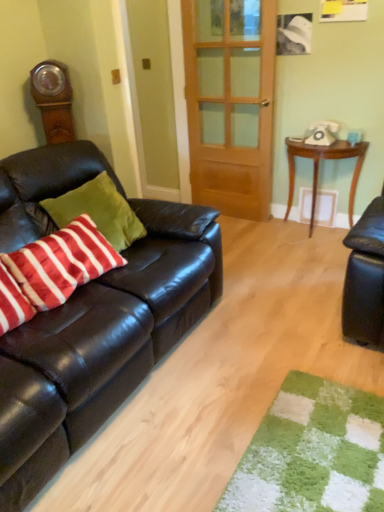
Question: Considering the relative sizes of white plastic phone at upper right and matte black couch at left in the image provided, is white plastic phone at upper right smaller than matte black couch at left?

Choices:
 (A) yes
 (B) no

Answer: (A)

Question: Does white plastic phone at upper right have a greater width compared to matte black couch at left?

Choices:
 (A) yes
 (B) no

Answer: (B)

Question: Is white plastic phone at upper right thinner than matte black couch at left?

Choices:
 (A) yes
 (B) no

Answer: (A)

Question: Is white plastic phone at upper right not within matte black couch at left?

Choices:
 (A) no
 (B) yes

Answer: (B)

Question: Can you confirm if white plastic phone at upper right is shorter than matte black couch at left?

Choices:
 (A) yes
 (B) no

Answer: (A)

Question: Is matte black couch at left a part of white plastic phone at upper right?

Choices:
 (A) yes
 (B) no

Answer: (B)

Question: From a real-world perspective, is velvety red and white striped pillow at left, the first pillow viewed from the right, positioned under striped cotton pillow at left, positioned as the second pillow in right-to-left order, based on gravity?

Choices:
 (A) yes
 (B) no

Answer: (A)

Question: Is velvety red and white striped pillow at left, which ranks as the 2th pillow in left-to-right order, at the left side of striped cotton pillow at left, arranged as the first pillow when viewed from the left?

Choices:
 (A) no
 (B) yes

Answer: (A)

Question: Is velvety red and white striped pillow at left, which ranks as the 2th pillow in left-to-right order, further to the viewer compared to striped cotton pillow at left, arranged as the first pillow when viewed from the left?

Choices:
 (A) yes
 (B) no

Answer: (A)

Question: Does velvety red and white striped pillow at left, which ranks as the 2th pillow in left-to-right order, have a lesser width compared to striped cotton pillow at left, positioned as the second pillow in right-to-left order?

Choices:
 (A) yes
 (B) no

Answer: (A)

Question: Is velvety red and white striped pillow at left, which ranks as the 2th pillow in left-to-right order, in contact with striped cotton pillow at left, positioned as the second pillow in right-to-left order?

Choices:
 (A) yes
 (B) no

Answer: (B)

Question: Considering the relative sizes of velvety red and white striped pillow at left, which ranks as the 2th pillow in left-to-right order, and striped cotton pillow at left, arranged as the first pillow when viewed from the left, in the image provided, is velvety red and white striped pillow at left, which ranks as the 2th pillow in left-to-right order, shorter than striped cotton pillow at left, arranged as the first pillow when viewed from the left,?

Choices:
 (A) no
 (B) yes

Answer: (A)

Question: From the image's perspective, is wooden door at center under velvety red and white striped pillow at left, which ranks as the 2th pillow in left-to-right order?

Choices:
 (A) yes
 (B) no

Answer: (B)